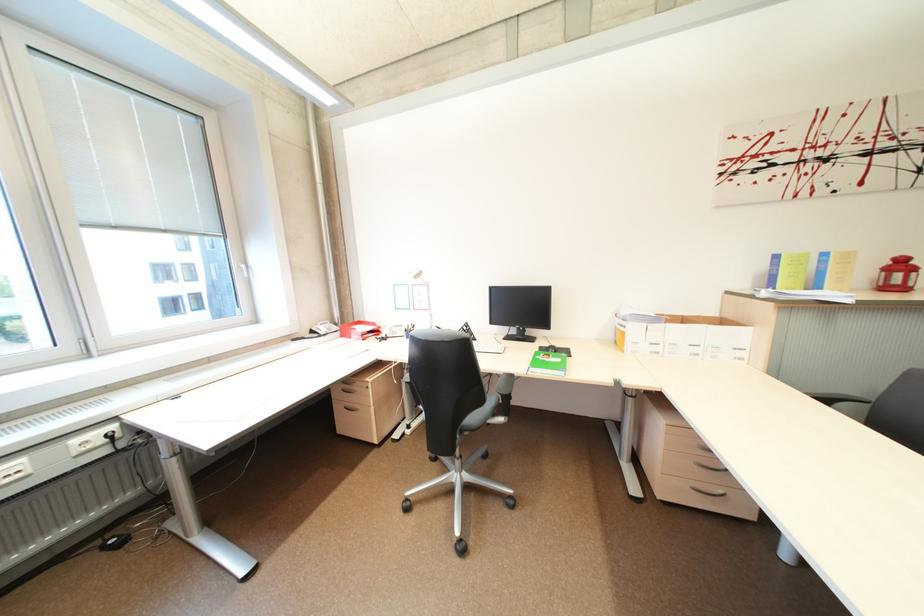
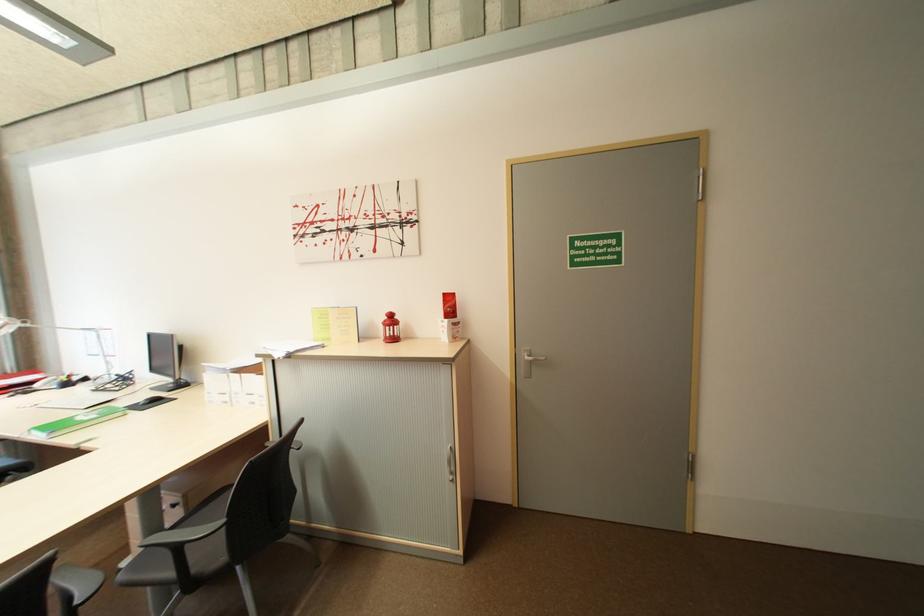
Question: Which direction would the cameraman need to move to produce the second image? Reply with the corresponding letter.

Choices:
 (A) Left
 (B) Right
 (C) Forward
 (D) Backward

Answer: (B)